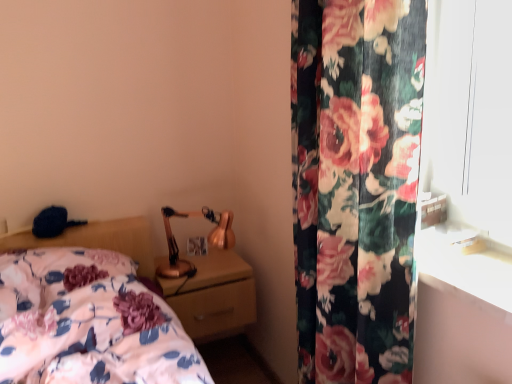
Question: Can you see matte gold nightstand at center touching floral fabric bed at lower left?

Choices:
 (A) no
 (B) yes

Answer: (A)

Question: Does matte gold nightstand at center contain floral fabric bed at lower left?

Choices:
 (A) yes
 (B) no

Answer: (B)

Question: From a real-world perspective, is matte gold nightstand at center under floral fabric bed at lower left?

Choices:
 (A) no
 (B) yes

Answer: (B)

Question: Considering the relative sizes of matte gold nightstand at center and floral fabric bed at lower left in the image provided, is matte gold nightstand at center thinner than floral fabric bed at lower left?

Choices:
 (A) yes
 (B) no

Answer: (A)

Question: From a real-world perspective, does matte gold nightstand at center stand above floral fabric bed at lower left?

Choices:
 (A) yes
 (B) no

Answer: (B)

Question: From the image's perspective, relative to matte gold nightstand at center, is floral fabric curtain at right above or below?

Choices:
 (A) below
 (B) above

Answer: (B)

Question: Which is correct: floral fabric curtain at right is inside matte gold nightstand at center, or outside of it?

Choices:
 (A) inside
 (B) outside

Answer: (B)

Question: From a real-world perspective, is floral fabric curtain at right above or below matte gold nightstand at center?

Choices:
 (A) below
 (B) above

Answer: (B)

Question: Based on their positions, is floral fabric curtain at right located to the left or right of matte gold nightstand at center?

Choices:
 (A) right
 (B) left

Answer: (A)

Question: From the image's perspective, relative to copper metallic table lamp at upper right, is floral fabric curtain at right above or below?

Choices:
 (A) above
 (B) below

Answer: (A)

Question: In terms of size, does floral fabric curtain at right appear bigger or smaller than copper metallic table lamp at upper right?

Choices:
 (A) small
 (B) big

Answer: (B)

Question: Is floral fabric curtain at right wider or thinner than copper metallic table lamp at upper right?

Choices:
 (A) thin
 (B) wide

Answer: (A)

Question: Would you say floral fabric curtain at right is inside or outside copper metallic table lamp at upper right?

Choices:
 (A) outside
 (B) inside

Answer: (A)

Question: From a real-world perspective, is floral fabric curtain at right positioned above or below floral fabric bed at lower left?

Choices:
 (A) above
 (B) below

Answer: (A)

Question: From the image's perspective, is floral fabric curtain at right positioned above or below floral fabric bed at lower left?

Choices:
 (A) below
 (B) above

Answer: (B)